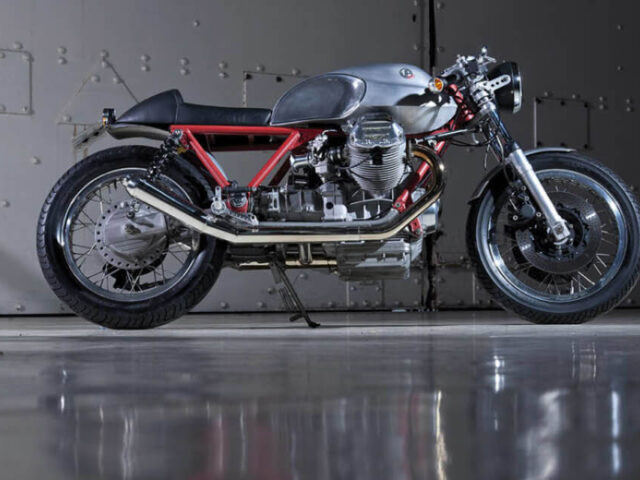
Where is `seat`? This screenshot has width=640, height=480. seat is located at coordinates (x=211, y=114).